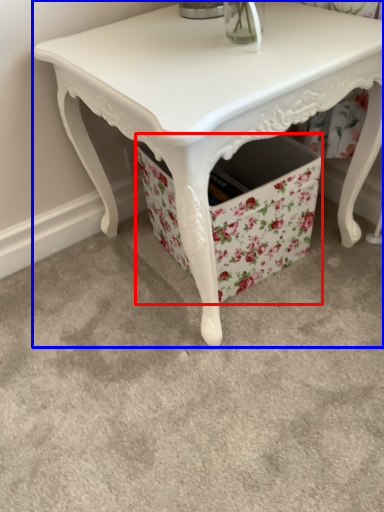
Question: Which point is further to the camera, storage box (highlighted by a red box) or table (highlighted by a blue box)?

Choices:
 (A) storage box
 (B) table

Answer: (A)